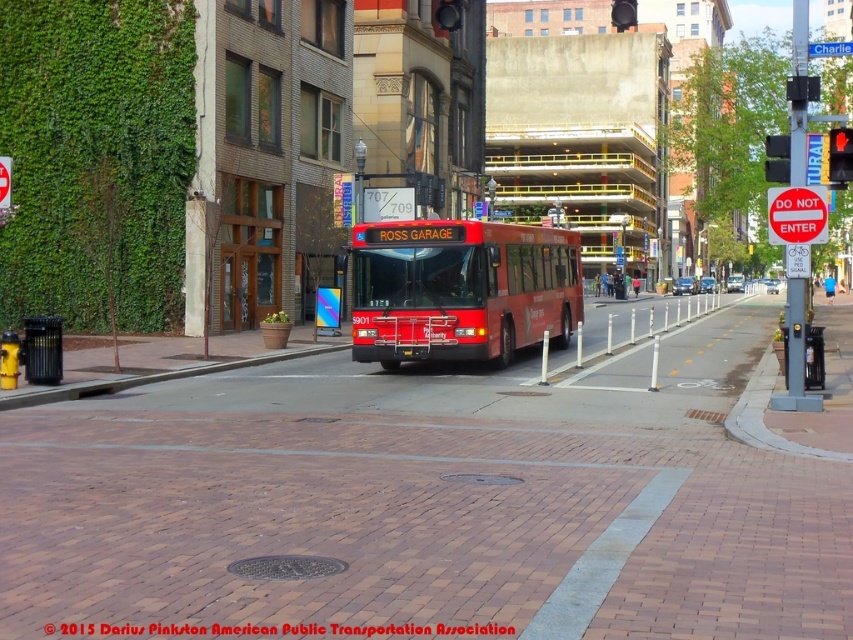
You are a delivery robot navigating the sidewalk in the image. Your current position is at point 0.5, 0.181. You need to move to the brick at center. Which direction should you move in to reach it?

The brick at center is located at point [154,378]. Since your current position is at [154,320], you should move to the right to reach it.

You are standing on the sidewalk and looking at the street scene. There are two points marked on the image. Which point, point (399, 333) or point (74, 392), is closer to you?

Point (399, 333) is closer to you because it is further to the viewer than point (74, 392).

You are standing on the sidewalk and want to cross the street to reach the other side. The pedestrian crossing is marked by white lines on the brick pavement at center. Where exactly should you step to use the crossing properly?

The brick pavement at center is located at point (433, 497), so you should step at that coordinate to use the crossing properly.